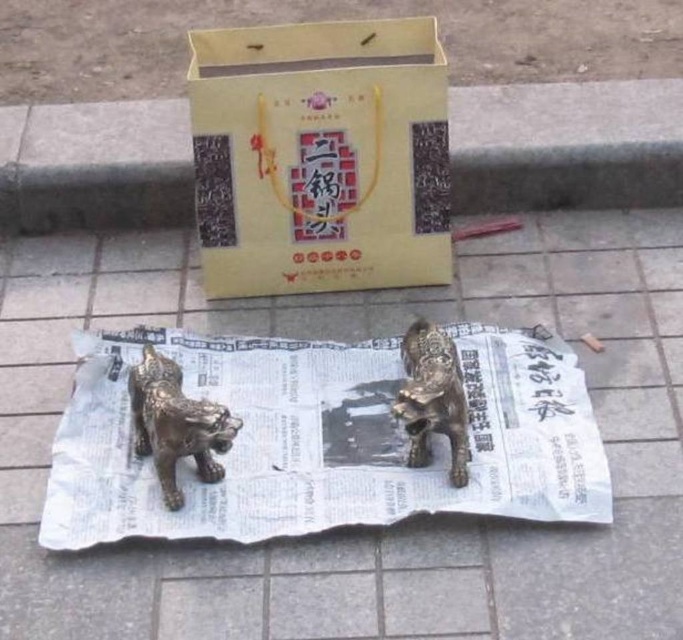
Is gold metallic lion statues at center closer to camera compared to matte cardboard box at upper center?

Yes.

Does gold metallic lion statues at center appear on the left side of matte cardboard box at upper center?

Yes, gold metallic lion statues at center is to the left of matte cardboard box at upper center.

Is point (510, 625) more distant than point (352, 260)?

That is False.

The height and width of the screenshot is (640, 683). In order to click on gold metallic lion statues at center in this screenshot , I will do `click(367, 528)`.

Can you confirm if matte cardboard box at upper center is smaller than gold metallic lion at center?

Incorrect, matte cardboard box at upper center is not smaller in size than gold metallic lion at center.

Between point (306, 211) and point (171, 486), which one is positioned in front?

Point (171, 486)

Identify the location of matte cardboard box at upper center. (320, 156).

Who is taller, gold metallic lion at center or shiny bronze lion at center?

shiny bronze lion at center is taller.

Is the position of gold metallic lion at center more distant than that of shiny bronze lion at center?

No, it is not.

This screenshot has width=683, height=640. What do you see at coordinates (176, 422) in the screenshot?
I see `gold metallic lion at center` at bounding box center [176, 422].

At what (x,y) coordinates should I click in order to perform the action: click on gold metallic lion at center. Please return your answer as a coordinate pair (x, y). The image size is (683, 640). Looking at the image, I should click on (176, 422).